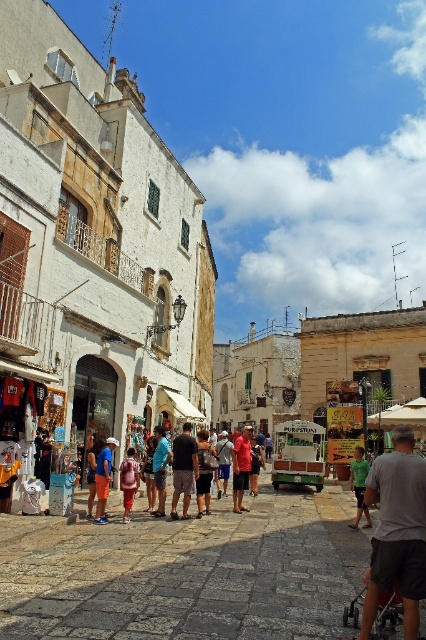
Can you confirm if gray fabric stroller at lower right is positioned below red shirt at center?

Actually, gray fabric stroller at lower right is above red shirt at center.

Locate an element on the screen. Image resolution: width=426 pixels, height=640 pixels. gray fabric stroller at lower right is located at coordinates (397, 531).

You are a GUI agent. You are given a task and a screenshot of the screen. Output one action in this format:
    pyautogui.click(x=<x>, y=<y>)
    Task: Click on the gray fabric stroller at lower right
    This screenshot has height=640, width=426.
    Given the screenshot: What is the action you would take?
    pyautogui.click(x=397, y=531)

Is denim shorts at center shorter than green cotton shirt at center?

Yes.

Between point (154, 428) and point (359, 506), which one is positioned in front?

Point (359, 506)

Identify the location of denim shorts at center. Image resolution: width=426 pixels, height=640 pixels. (161, 467).

Can you confirm if orange cotton shorts at center is positioned to the left of denim shorts at center?

Correct, you'll find orange cotton shorts at center to the left of denim shorts at center.

Does orange cotton shorts at center have a greater height compared to denim shorts at center?

Yes, orange cotton shorts at center is taller than denim shorts at center.

Where is `orange cotton shorts at center`? This screenshot has height=640, width=426. orange cotton shorts at center is located at coordinates click(103, 477).

Identify the location of orange cotton shorts at center. (103, 477).